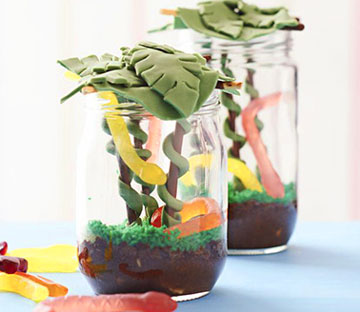
Find the location of a particular element. This screenshot has width=360, height=312. glass jars is located at coordinates (197, 276), (258, 223).